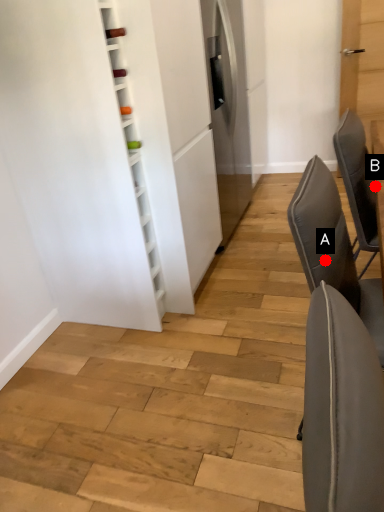
Question: Two points are circled on the image, labeled by A and B beside each circle. Which of the following is the closest to the observer?

Choices:
 (A) A is closer
 (B) B is closer

Answer: (A)